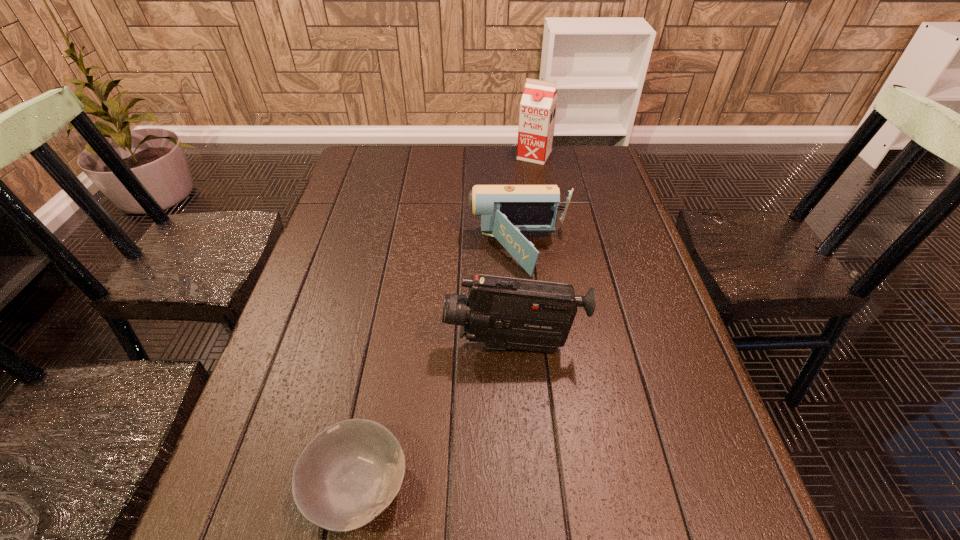
Where is `free point located 0.270m on the side of the shorter camcorder with the flip-out screen`? The width and height of the screenshot is (960, 540). free point located 0.270m on the side of the shorter camcorder with the flip-out screen is located at coordinates click(368, 251).

Locate an element on the screen. The image size is (960, 540). free space located on the side of the shorter camcorder with the flip-out screen is located at coordinates (449, 251).

This screenshot has width=960, height=540. I want to click on free space located on the side of the shorter camcorder with the flip-out screen, so pos(423,251).

The image size is (960, 540). I want to click on object at the far edge, so click(x=538, y=106).

In order to click on free space at the far edge in this screenshot , I will do `click(545, 175)`.

Where is `blank space at the left edge of the desktop`? blank space at the left edge of the desktop is located at coordinates (348, 271).

Locate an element on the screen. Image resolution: width=960 pixels, height=540 pixels. vacant space at the right edge of the desktop is located at coordinates (604, 296).

Find the location of a particular element. Image resolution: width=960 pixels, height=540 pixels. vacant space at the far left corner is located at coordinates (381, 159).

The image size is (960, 540). Identify the location of vacant space at the far right corner of the desktop. (583, 156).

Identify which object is the third nearest to the nearest object. Please provide its 2D coordinates. Your answer should be formatted as a tuple, i.e. [(x, y)], where the tuple contains the x and y coordinates of a point satisfying the conditions above.

[(538, 106)]